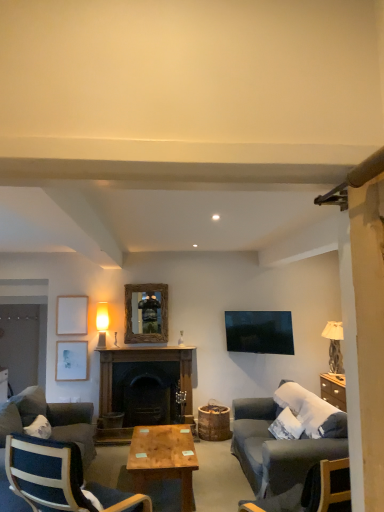
Question: Is wooden mirror at center, the third picture frame when ordered from left to right, oriented towards dark wood fireplace at center?

Choices:
 (A) yes
 (B) no

Answer: (B)

Question: Is wooden mirror at center, the third picture frame when ordered from left to right, smaller than dark wood fireplace at center?

Choices:
 (A) no
 (B) yes

Answer: (B)

Question: From a real-world perspective, is wooden mirror at center, which is the first picture frame from right to left, physically below dark wood fireplace at center?

Choices:
 (A) no
 (B) yes

Answer: (A)

Question: Considering the relative positions of wooden mirror at center, the third picture frame when ordered from left to right, and dark wood fireplace at center in the image provided, is wooden mirror at center, the third picture frame when ordered from left to right, in front of dark wood fireplace at center?

Choices:
 (A) no
 (B) yes

Answer: (A)

Question: Does wooden mirror at center, the third picture frame when ordered from left to right, lie behind dark wood fireplace at center?

Choices:
 (A) no
 (B) yes

Answer: (B)

Question: Is dark blue fabric chair at lower left taller or shorter than wooden mirror at center, which is the first picture frame from right to left?

Choices:
 (A) short
 (B) tall

Answer: (B)

Question: From a real-world perspective, is dark blue fabric chair at lower left positioned above or below wooden mirror at center, the third picture frame when ordered from left to right?

Choices:
 (A) above
 (B) below

Answer: (B)

Question: Is point (117, 501) positioned closer to the camera than point (162, 335)?

Choices:
 (A) farther
 (B) closer

Answer: (B)

Question: Considering the positions of dark blue fabric chair at lower left and wooden mirror at center, the third picture frame when ordered from left to right, in the image, is dark blue fabric chair at lower left bigger or smaller than wooden mirror at center, the third picture frame when ordered from left to right,?

Choices:
 (A) big
 (B) small

Answer: (A)

Question: Is wooden polished coffee table at center wider or thinner than matte white lampshade at upper left, the first lamp in the left-to-right sequence?

Choices:
 (A) wide
 (B) thin

Answer: (A)

Question: Based on their sizes in the image, would you say wooden polished coffee table at center is bigger or smaller than matte white lampshade at upper left, the second lamp positioned from the right?

Choices:
 (A) small
 (B) big

Answer: (B)

Question: From the image's perspective, is wooden polished coffee table at center located above or below matte white lampshade at upper left, the first lamp in the left-to-right sequence?

Choices:
 (A) above
 (B) below

Answer: (B)

Question: Visually, is wooden polished coffee table at center positioned to the left or to the right of matte white lampshade at upper left, the second lamp positioned from the right?

Choices:
 (A) right
 (B) left

Answer: (A)

Question: From their relative heights in the image, would you say dark gray fabric couch at lower left, the first studio couch from the back, is taller or shorter than matte white lampshade at upper left, the first lamp in the left-to-right sequence?

Choices:
 (A) short
 (B) tall

Answer: (B)

Question: Would you say dark gray fabric couch at lower left, which is the 1th studio couch from left to right, is inside or outside matte white lampshade at upper left, the first lamp in the left-to-right sequence?

Choices:
 (A) outside
 (B) inside

Answer: (A)